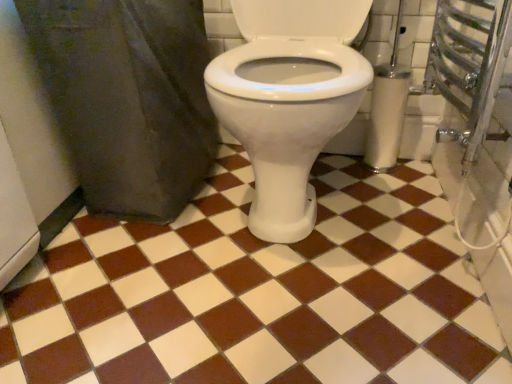
Describe the element at coordinates (260, 293) in the screenshot. I see `white glossy tile at center` at that location.

Measure the distance between white glossy tile at center and camera.

The depth of white glossy tile at center is 28.17 inches.

Find the location of a particular element. This screenshot has height=384, width=512. white glossy tile at center is located at coordinates (260, 293).

Where is `white glossy tile at center`? Image resolution: width=512 pixels, height=384 pixels. white glossy tile at center is located at coordinates (260, 293).